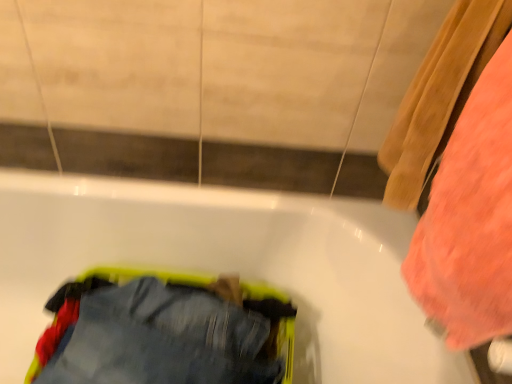
Question: Is fluffy coral towel at right inside or outside of denim pants at lower left?

Choices:
 (A) outside
 (B) inside

Answer: (A)

Question: From a real-world perspective, is fluffy coral towel at right above or below denim pants at lower left?

Choices:
 (A) above
 (B) below

Answer: (A)

Question: Based on their relative distances, which object is farther from the denim pants at lower left?

Choices:
 (A) fluffy coral towel at right
 (B) white glossy bathtub at center

Answer: (A)

Question: Which object is the closest to the denim pants at lower left?

Choices:
 (A) fluffy coral towel at right
 (B) white glossy bathtub at center

Answer: (B)